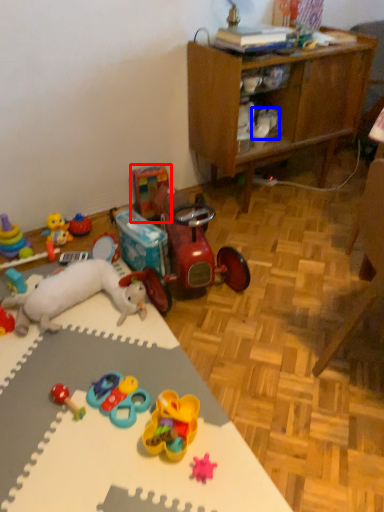
Question: Which object is closer to the camera taking this photo, toy (highlighted by a red box) or footwear (highlighted by a blue box)?

Choices:
 (A) toy
 (B) footwear

Answer: (B)